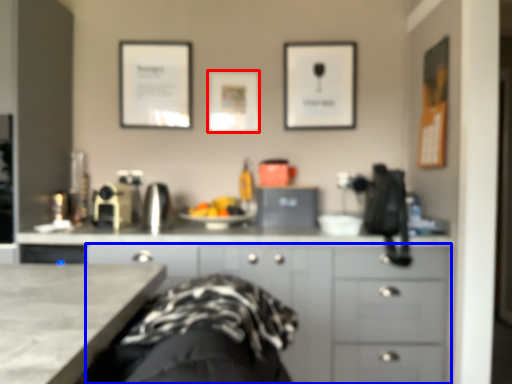
Question: Which of the following is the farthest to the observer, picture frame (highlighted by a red box) or cabinetry (highlighted by a blue box)?

Choices:
 (A) picture frame
 (B) cabinetry

Answer: (A)